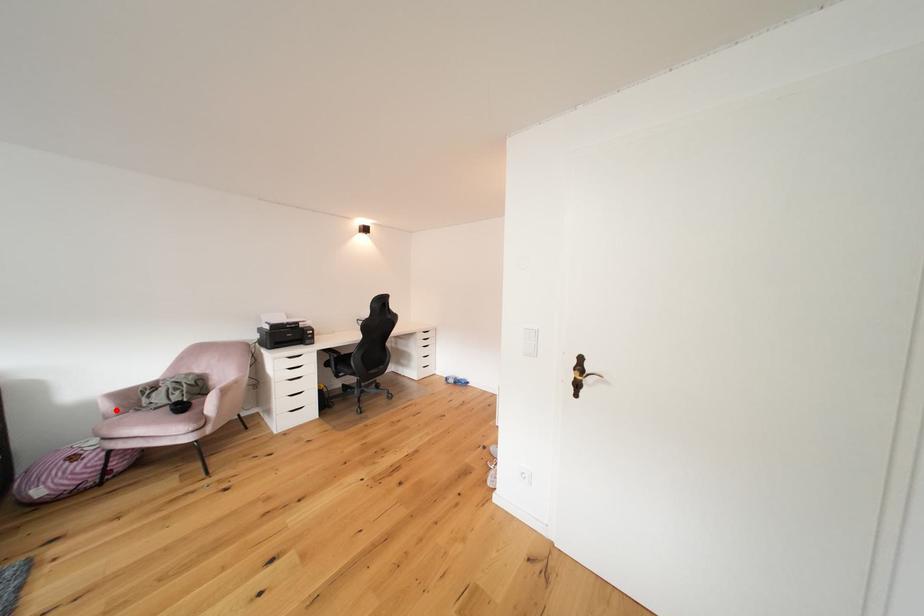
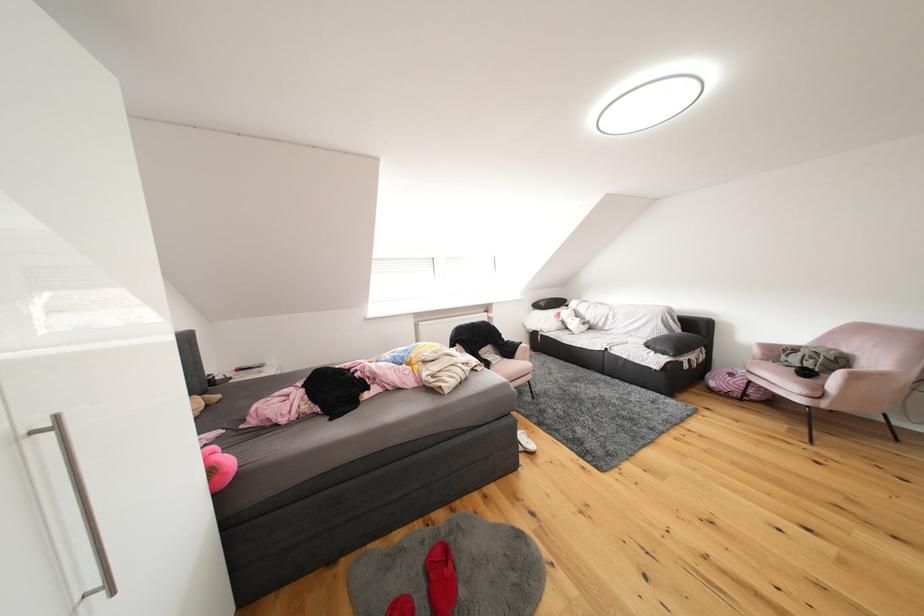
Where in the second image is the point corresponding to the highlighted location from the first image?

(766, 355)